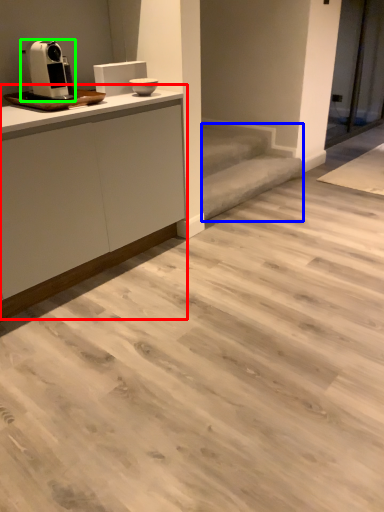
Question: Based on their relative distances, which object is nearer to cabinetry (highlighted by a red box)? Choose from stair (highlighted by a blue box) and home appliance (highlighted by a green box).

Choices:
 (A) stair
 (B) home appliance

Answer: (B)